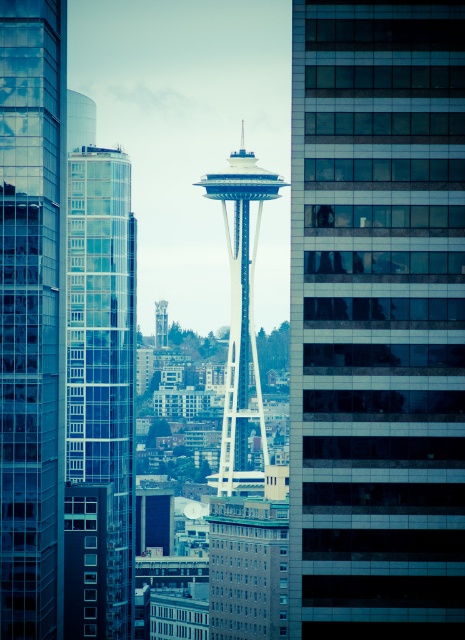
Question: Which object is closer to the camera taking this photo?

Choices:
 (A) metallic silver tower at center
 (B) white glass tower at center
 (C) transparent glass skyscraper at left
 (D) glassy reflective skyscraper at center

Answer: (D)

Question: Estimate the real-world distances between objects in this image. Which object is farther from the transparent glass skyscraper at left?

Choices:
 (A) metallic silver tower at center
 (B) clear glass building at left
 (C) white glass tower at center

Answer: (C)

Question: Observing the image, what is the correct spatial positioning of glassy reflective skyscraper at center in reference to transparent glass skyscraper at left?

Choices:
 (A) below
 (B) above

Answer: (A)

Question: Among these objects, which one is farthest from the camera?

Choices:
 (A) glassy reflective skyscraper at center
 (B) clear glass building at left
 (C) transparent glass skyscraper at left
 (D) metallic silver tower at center

Answer: (C)

Question: Does glassy reflective skyscraper at center have a larger size compared to metallic silver tower at center?

Choices:
 (A) yes
 (B) no

Answer: (A)

Question: Does clear glass building at left appear on the right side of metallic silver tower at center?

Choices:
 (A) no
 (B) yes

Answer: (A)